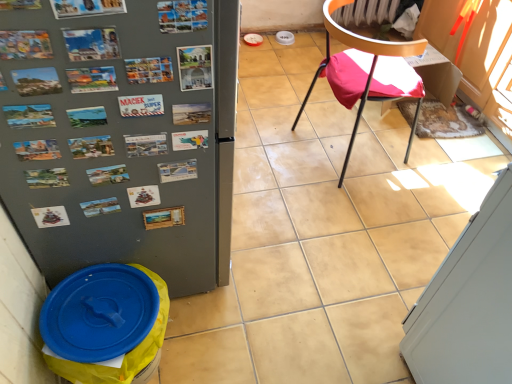
Question: Does metallic postcards at upper center have a greater width compared to blue plastic lid at lower left?

Choices:
 (A) yes
 (B) no

Answer: (B)

Question: Is metallic postcards at upper center not near blue plastic lid at lower left?

Choices:
 (A) no
 (B) yes

Answer: (A)

Question: From a real-world perspective, is metallic postcards at upper center located higher than blue plastic lid at lower left?

Choices:
 (A) no
 (B) yes

Answer: (B)

Question: From the image's perspective, is metallic postcards at upper center beneath blue plastic lid at lower left?

Choices:
 (A) no
 (B) yes

Answer: (A)

Question: Can you confirm if metallic postcards at upper center is bigger than blue plastic lid at lower left?

Choices:
 (A) no
 (B) yes

Answer: (A)

Question: Are metallic postcards at upper center and blue plastic lid at lower left beside each other?

Choices:
 (A) yes
 (B) no

Answer: (B)

Question: Does metallic gray refrigerator at left have a lesser height compared to white glossy screen door at lower right?

Choices:
 (A) no
 (B) yes

Answer: (A)

Question: Is metallic gray refrigerator at left to the left of white glossy screen door at lower right from the viewer's perspective?

Choices:
 (A) no
 (B) yes

Answer: (B)

Question: Would you consider metallic gray refrigerator at left to be distant from white glossy screen door at lower right?

Choices:
 (A) no
 (B) yes

Answer: (A)

Question: Does metallic gray refrigerator at left lie behind white glossy screen door at lower right?

Choices:
 (A) yes
 (B) no

Answer: (B)

Question: Is metallic gray refrigerator at left looking in the opposite direction of white glossy screen door at lower right?

Choices:
 (A) yes
 (B) no

Answer: (B)

Question: Is metallic gray refrigerator at left outside of white glossy screen door at lower right?

Choices:
 (A) no
 (B) yes

Answer: (B)

Question: Are metallic postcards at upper center and metallic black chair at center right far apart?

Choices:
 (A) no
 (B) yes

Answer: (B)